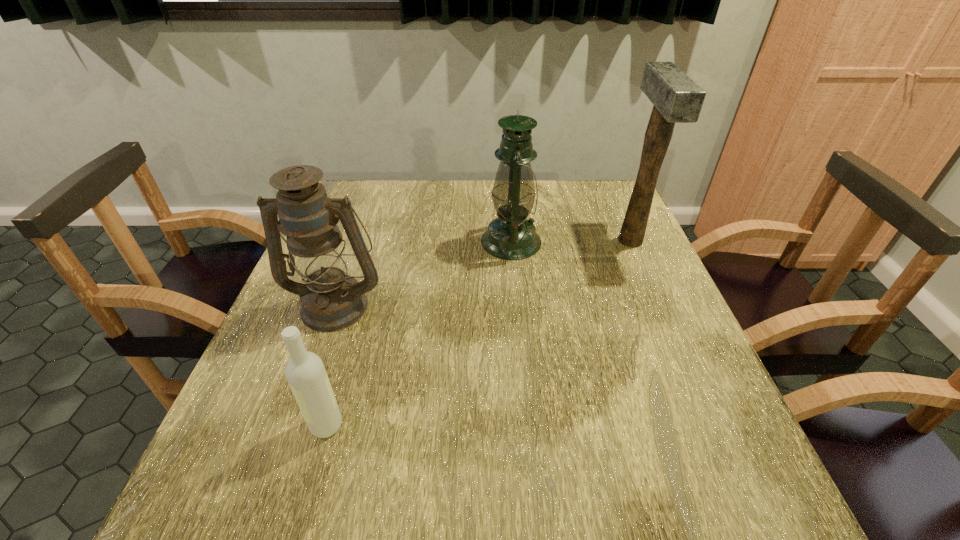
This screenshot has width=960, height=540. I want to click on free space between the shortest object and the mallet, so click(478, 333).

Identify the location of free point between the farther oil lamp and the nearer oil lamp. The width and height of the screenshot is (960, 540). (423, 273).

Image resolution: width=960 pixels, height=540 pixels. Find the location of `blank region between the tallest object and the shortest object`. blank region between the tallest object and the shortest object is located at coordinates (478, 333).

Where is `vacant region between the farther oil lamp and the shortest object`? vacant region between the farther oil lamp and the shortest object is located at coordinates (419, 333).

Where is `the second closest object relative to the shortest object`? This screenshot has width=960, height=540. the second closest object relative to the shortest object is located at coordinates (511, 236).

Point out which object is positioned as the nearest to the farther oil lamp. Please provide its 2D coordinates. Your answer should be formatted as a tuple, i.e. [(x, y)], where the tuple contains the x and y coordinates of a point satisfying the conditions above.

[(676, 98)]

Locate an element on the screen. This screenshot has height=540, width=960. vacant point that satisfies the following two spatial constraints: 1. on the back side of the second object from right to left; 2. on the right side of the tallest object is located at coordinates (511, 240).

Locate an element on the screen. The height and width of the screenshot is (540, 960). free space that satisfies the following two spatial constraints: 1. on the back side of the shortest object; 2. on the right side of the second object from right to left is located at coordinates tap(379, 242).

Find the location of a particular element. The height and width of the screenshot is (540, 960). free region that satisfies the following two spatial constraints: 1. on the back side of the right oil lamp; 2. on the left side of the tallest object is located at coordinates (511, 240).

Where is `vacant space that satisfies the following two spatial constraints: 1. on the back side of the nearer oil lamp; 2. on the right side of the rightmost object`? vacant space that satisfies the following two spatial constraints: 1. on the back side of the nearer oil lamp; 2. on the right side of the rightmost object is located at coordinates (358, 240).